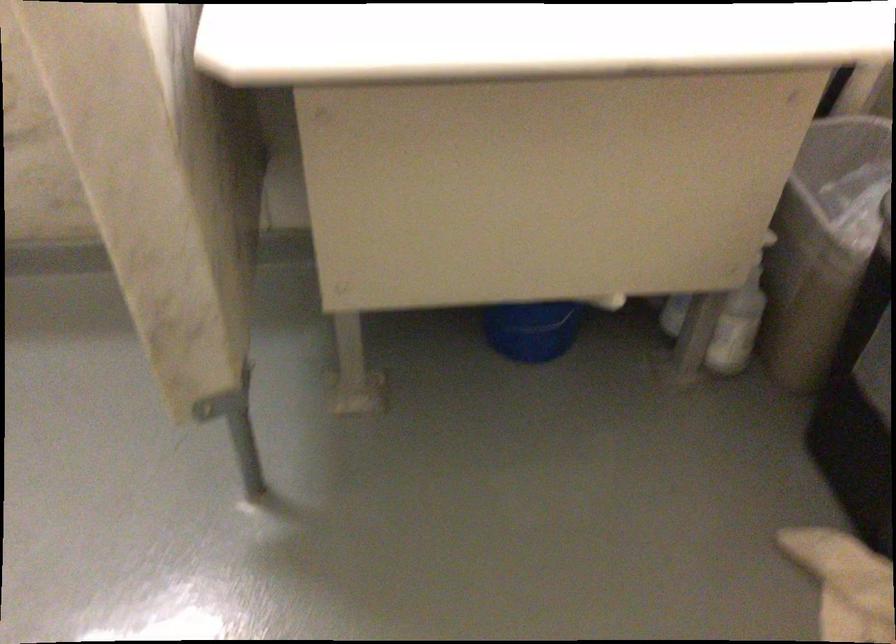
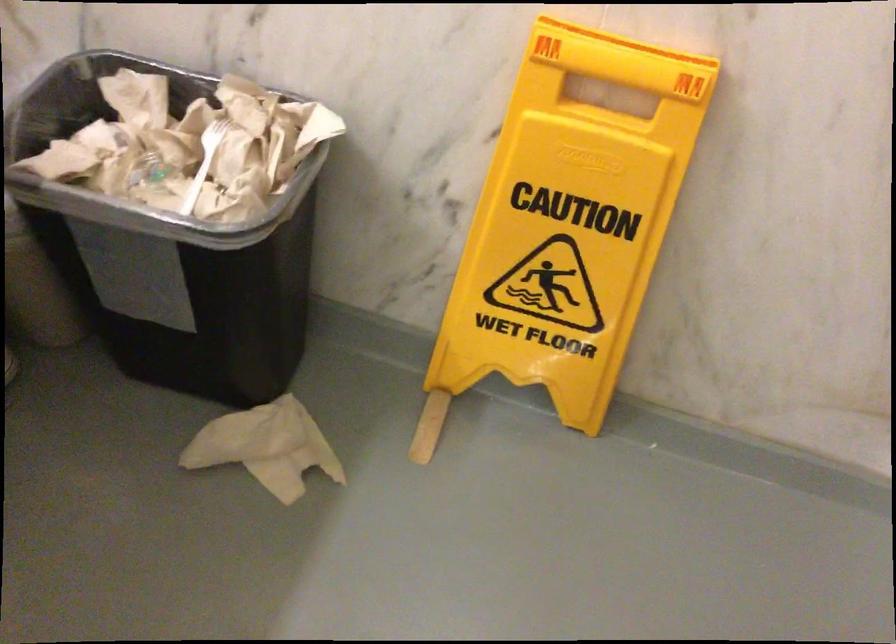
How did the camera likely rotate?

The camera rotated toward right-down.